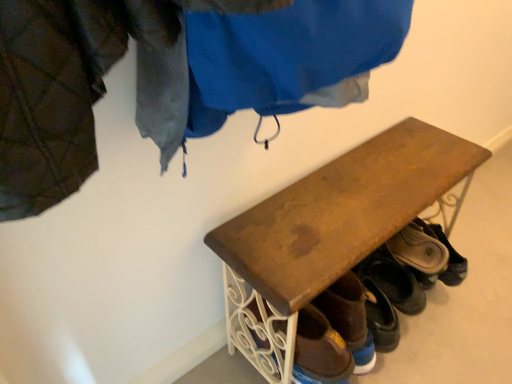
Question: Is the position of wooden bench at center more distant than that of brown leather shoe at lower right, which is the 2th footwear from right to left?

Choices:
 (A) no
 (B) yes

Answer: (A)

Question: Are wooden bench at center and brown leather shoe at lower right, which is the 2th footwear from right to left, located far from each other?

Choices:
 (A) yes
 (B) no

Answer: (B)

Question: From the image's perspective, is wooden bench at center beneath brown leather shoe at lower right, placed as the 2th footwear when sorted from front to back?

Choices:
 (A) yes
 (B) no

Answer: (A)

Question: Is wooden bench at center facing towards brown leather shoe at lower right, the second footwear viewed from the back?

Choices:
 (A) no
 (B) yes

Answer: (B)

Question: Would you say wooden bench at center contains brown leather shoe at lower right, which is the 2th footwear from right to left?

Choices:
 (A) no
 (B) yes

Answer: (B)

Question: Can you confirm if wooden bench at center is smaller than brown leather shoe at lower right, the second footwear viewed from the back?

Choices:
 (A) no
 (B) yes

Answer: (A)

Question: Is brown suede shoe at lower right, the 1th footwear viewed from the right, outside of wooden bench at center?

Choices:
 (A) no
 (B) yes

Answer: (A)

Question: Does brown suede shoe at lower right, the 3th footwear from the front, have a greater height compared to wooden bench at center?

Choices:
 (A) yes
 (B) no

Answer: (B)

Question: Is brown suede shoe at lower right, arranged as the 1th footwear when viewed from the back, bigger than wooden bench at center?

Choices:
 (A) yes
 (B) no

Answer: (B)

Question: Is brown suede shoe at lower right, arranged as the 1th footwear when viewed from the back, closer to camera compared to wooden bench at center?

Choices:
 (A) no
 (B) yes

Answer: (A)

Question: Does brown suede shoe at lower right, the 1th footwear viewed from the right, appear on the left side of wooden bench at center?

Choices:
 (A) no
 (B) yes

Answer: (A)

Question: Is brown suede shoe at lower right, arranged as the 1th footwear when viewed from the back, aimed at wooden bench at center?

Choices:
 (A) no
 (B) yes

Answer: (B)

Question: Does brown suede shoe at lower right, arranged as the 1th footwear when viewed from the back, lie behind brown leather shoe at lower right, the second footwear in the left-to-right sequence?

Choices:
 (A) no
 (B) yes

Answer: (B)